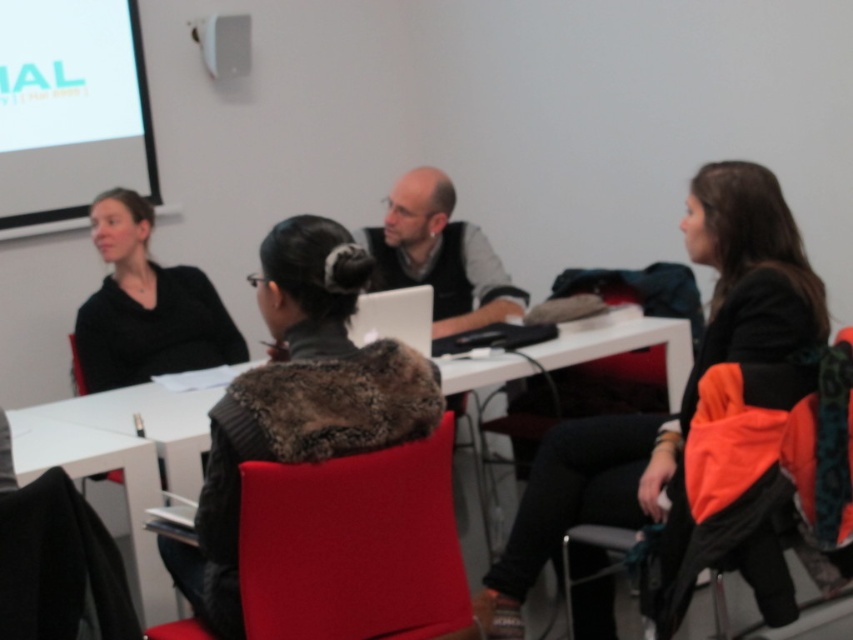
Is white plastic table at center further to camera compared to orange fabric chair at lower right?

Yes.

Between white plastic table at center and orange fabric chair at lower right, which one is positioned lower?

Positioned lower is orange fabric chair at lower right.

Is point (444, 376) positioned in front of point (840, 531)?

That is False.

Find the location of a particular element. white plastic table at center is located at coordinates (122, 458).

Is black leather jacket at center thinner than black fabric chair at lower left?

No.

Does black leather jacket at center appear over black fabric chair at lower left?

Indeed, black leather jacket at center is positioned over black fabric chair at lower left.

Is point (596, 608) less distant than point (42, 632)?

No, it is not.

At what (x,y) coordinates should I click in order to perform the action: click on black leather jacket at center. Please return your answer as a coordinate pair (x, y). Looking at the image, I should click on (683, 388).

Is white plastic table at center below black matte jacket at left?

Indeed, white plastic table at center is positioned under black matte jacket at left.

Is white plastic table at center taller than black matte jacket at left?

No.

Where is `white plastic table at center`? white plastic table at center is located at coordinates pos(122,458).